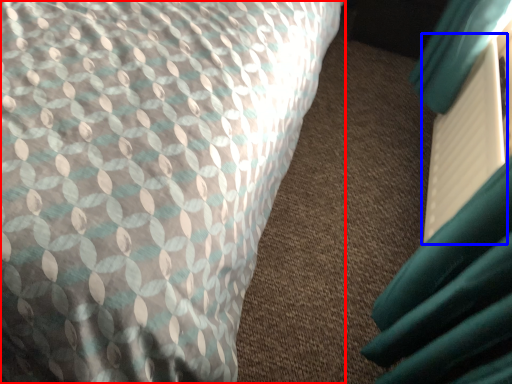
Question: Which point is closer to the camera, bed (highlighted by a red box) or paperback book (highlighted by a blue box)?

Choices:
 (A) bed
 (B) paperback book

Answer: (A)